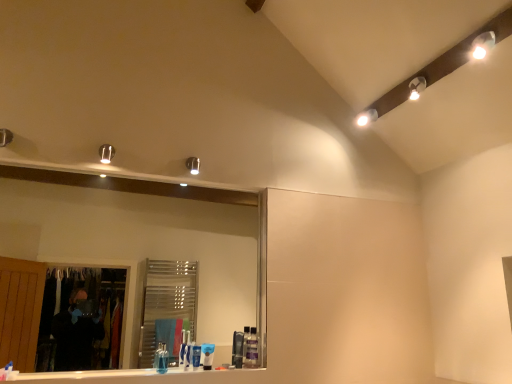
Question: Does blue matte toothpaste at center, placed as the third toiletry when sorted from right to left, have a greater width compared to white glossy toothpaste at lower center, the 2th toothpaste when ordered from front to back?

Choices:
 (A) yes
 (B) no

Answer: (B)

Question: From a real-world perspective, is blue matte toothpaste at center, the second toiletry from the left, physically above white glossy toothpaste at lower center, which ranks as the 1th toothpaste in right-to-left order?

Choices:
 (A) no
 (B) yes

Answer: (B)

Question: Does blue matte toothpaste at center, the second toiletry from the left, have a smaller size compared to white glossy toothpaste at lower center, the 2th toothpaste when ordered from front to back?

Choices:
 (A) yes
 (B) no

Answer: (A)

Question: Does blue matte toothpaste at center, placed as the third toiletry when sorted from right to left, have a larger size compared to white glossy toothpaste at lower center, which ranks as the 1th toothpaste in right-to-left order?

Choices:
 (A) no
 (B) yes

Answer: (A)

Question: Is blue matte toothpaste at center, placed as the third toiletry when sorted from right to left, located outside white glossy toothpaste at lower center, which ranks as the 1th toothpaste in right-to-left order?

Choices:
 (A) yes
 (B) no

Answer: (A)

Question: In the image, is matte silver light fixture at upper left positioned in front of or behind clear glass mirror at center?

Choices:
 (A) front
 (B) behind

Answer: (B)

Question: From the image's perspective, is matte silver light fixture at upper left positioned above or below clear glass mirror at center?

Choices:
 (A) below
 (B) above

Answer: (B)

Question: Is matte silver light fixture at upper left taller or shorter than clear glass mirror at center?

Choices:
 (A) tall
 (B) short

Answer: (B)

Question: Considering the positions of matte silver light fixture at upper left and clear glass mirror at center in the image, is matte silver light fixture at upper left wider or thinner than clear glass mirror at center?

Choices:
 (A) thin
 (B) wide

Answer: (B)

Question: From a real-world perspective, is translucent plastic soap dispenser at center, acting as the 2th toiletry starting from the right, above or below white glossy toothpaste at lower left, which appears as the 2th toothpaste when viewed from the right?

Choices:
 (A) below
 (B) above

Answer: (B)

Question: Based on their positions, is translucent plastic soap dispenser at center, positioned as the 3th toiletry in left-to-right order, located to the left or right of white glossy toothpaste at lower left, the 1th toothpaste viewed from the left?

Choices:
 (A) left
 (B) right

Answer: (B)

Question: Looking at the image, does translucent plastic soap dispenser at center, positioned as the 3th toiletry in left-to-right order, seem bigger or smaller compared to white glossy toothpaste at lower left, the 1th toothpaste viewed from the left?

Choices:
 (A) small
 (B) big

Answer: (B)

Question: Considering the positions of translucent plastic soap dispenser at center, positioned as the 3th toiletry in left-to-right order, and white glossy toothpaste at lower left, the first toothpaste when ordered from front to back, in the image, is translucent plastic soap dispenser at center, positioned as the 3th toiletry in left-to-right order, wider or thinner than white glossy toothpaste at lower left, the first toothpaste when ordered from front to back,?

Choices:
 (A) wide
 (B) thin

Answer: (B)

Question: Do you think translucent plastic container at lower center, which ranks as the fourth toiletry in left-to-right order, is within white glossy light fixture at upper right, or outside of it?

Choices:
 (A) inside
 (B) outside

Answer: (B)

Question: From the image's perspective, is translucent plastic container at lower center, placed as the first toiletry when sorted from right to left, located above or below white glossy light fixture at upper right?

Choices:
 (A) below
 (B) above

Answer: (A)